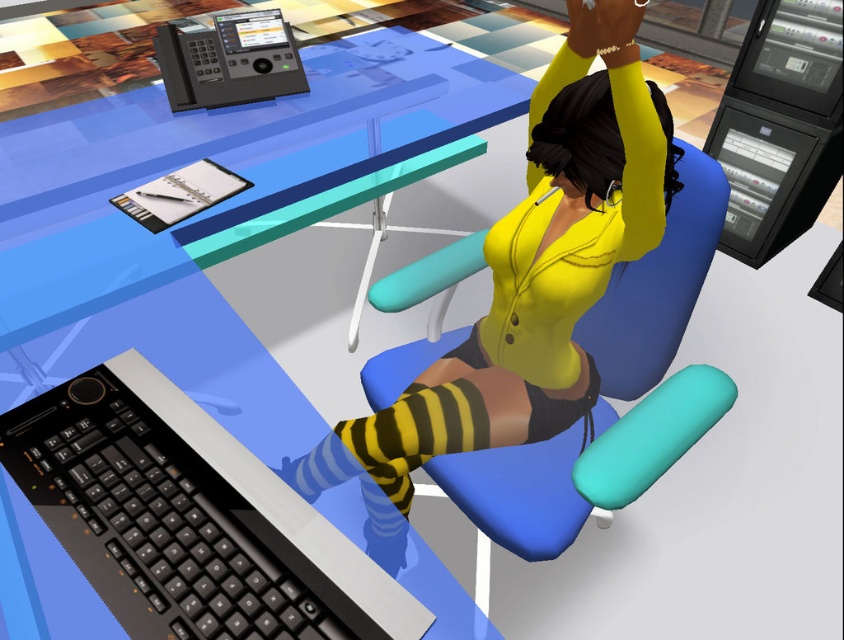
You are planning to place a rectangular object that is 1.2 meters wide on the blue plastic table at center. Considering the table and chair dimensions, will the object fit on the table without overlapping the blue fabric chair at center?

The blue plastic table at center is wider than the blue fabric chair at center. Since the object is 1.2 meters wide, it can fit on the table as long as it is placed towards the edge opposite the chair, ensuring it doesn

You are standing in the office depicted in the scene. Where exactly is the blue plastic table at center located in terms of coordinates?

The blue plastic table at center is located at point coordinates of (x=206, y=218).

You are designing a desk layout and need to ensure the black plastic keyboard at lower left and the blue fabric chair at center fit within a 1.2 meter wide desk. Given their sizes, will they both fit comfortably?

The black plastic keyboard at lower left is smaller than the blue fabric chair at center. Since the desk is 1.2 meters wide, both items can fit comfortably as the keyboard takes up less space and the chair occupies the central area without exceeding the desk width.